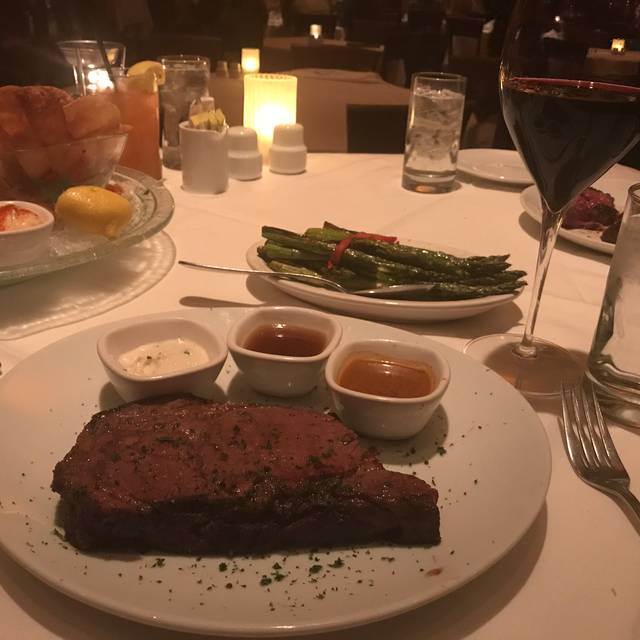
This screenshot has height=640, width=640. Identify the location of glass plate. (79, 249).